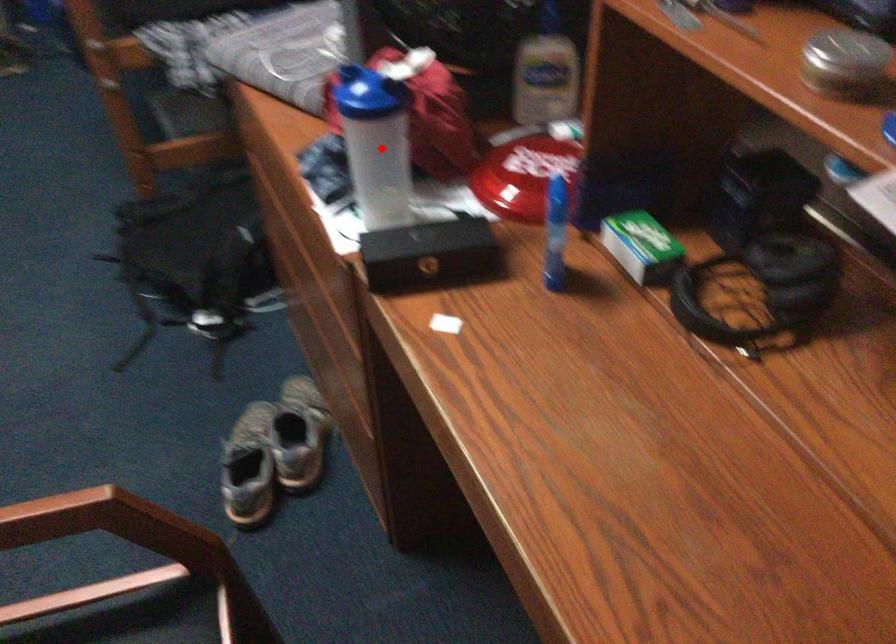
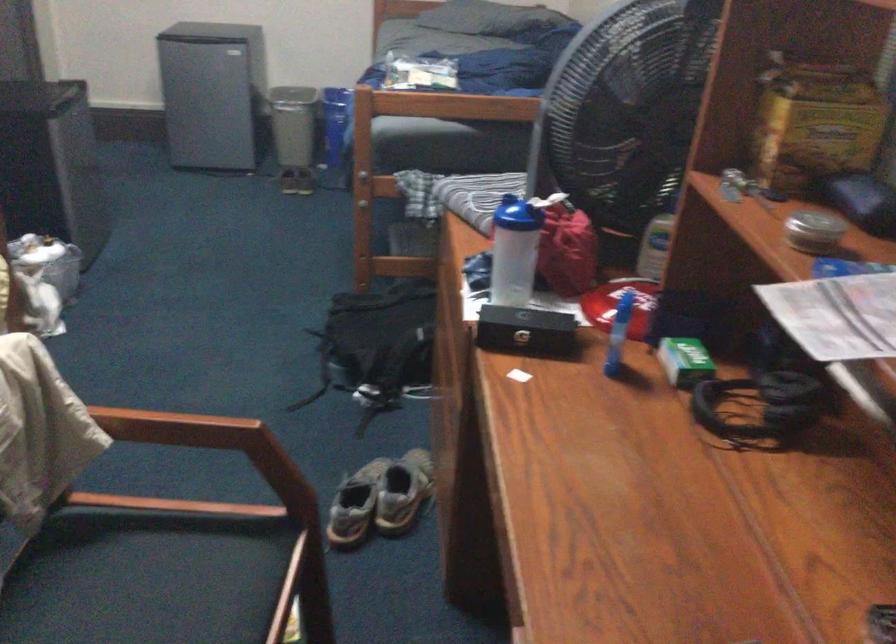
The point at the highlighted location is marked in the first image. Where is the corresponding point in the second image?

(513, 251)